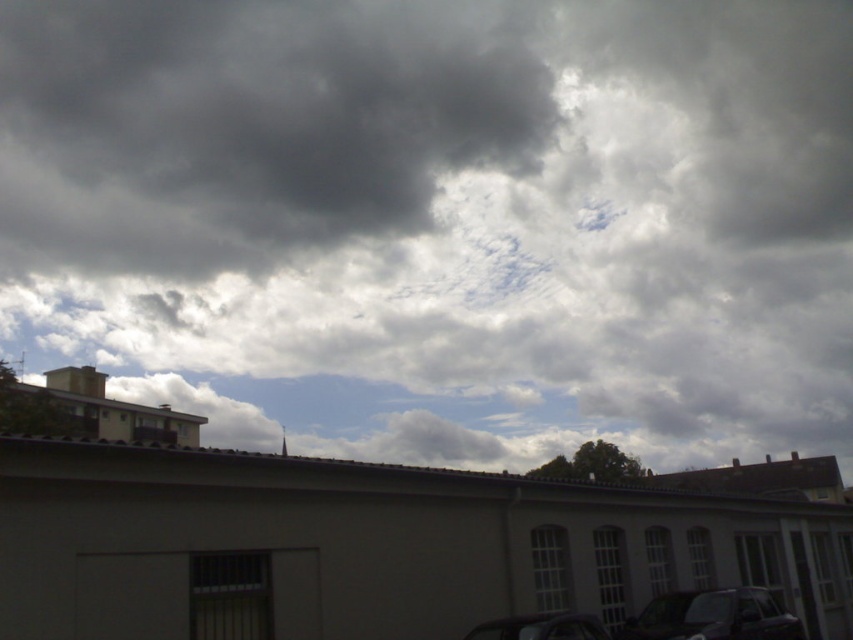
Based on the coordinates provided, which object in the scene is located at point (248, 125)?

The dark gray cloud at upper left is located at point (248, 125).

You are an architect designing a new building. You observe the dark gray cloud at upper center and the shiny black car at bottom right in the image. Which object would cast a larger shadow given their sizes?

The dark gray cloud at upper center has a larger size compared to the shiny black car at bottom right, so it would cast a larger shadow.

Based on the scene description, where is the dark gray cloud at upper center located in the image?

The dark gray cloud at upper center is located at point (440, 221).